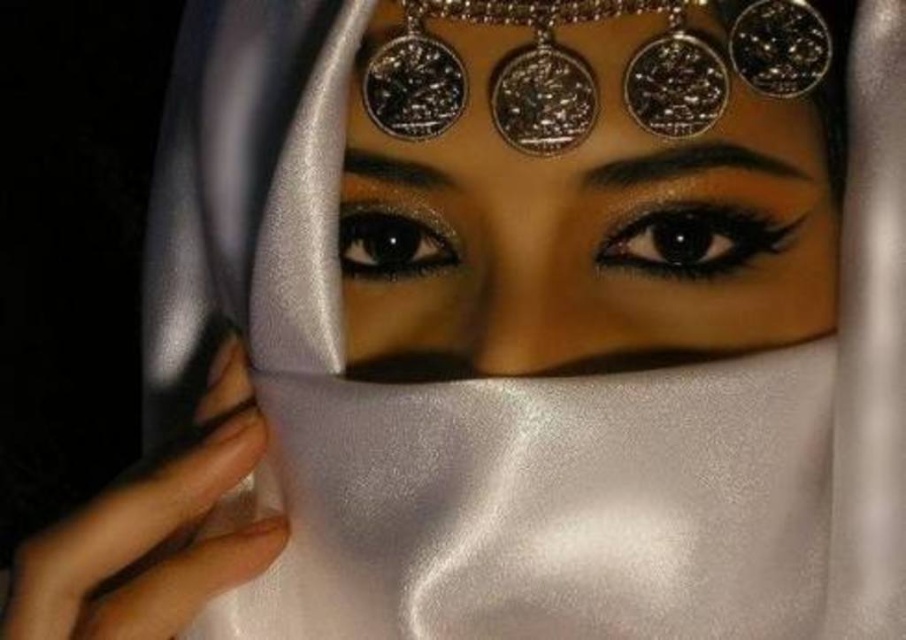
Question: Based on their relative distances, which object is nearer to the shiny black eye at center?

Choices:
 (A) black matte eye at center
 (B) metallic silver coins at center

Answer: (B)

Question: Is metallic silver coins at center to the right of shiny black eye at center from the viewer's perspective?

Choices:
 (A) no
 (B) yes

Answer: (B)

Question: Can you confirm if metallic silver coins at center is bigger than shiny black eye at center?

Choices:
 (A) yes
 (B) no

Answer: (A)

Question: Which point is farther from the camera taking this photo?

Choices:
 (A) (808, 256)
 (B) (624, 227)
 (C) (411, 228)

Answer: (C)

Question: Estimate the real-world distances between objects in this image. Which object is farther from the shiny black eye at center?

Choices:
 (A) metallic silver coins at center
 (B) black matte eye at center

Answer: (B)

Question: Is metallic silver coins at center positioned at the back of shiny black eye at center?

Choices:
 (A) yes
 (B) no

Answer: (B)